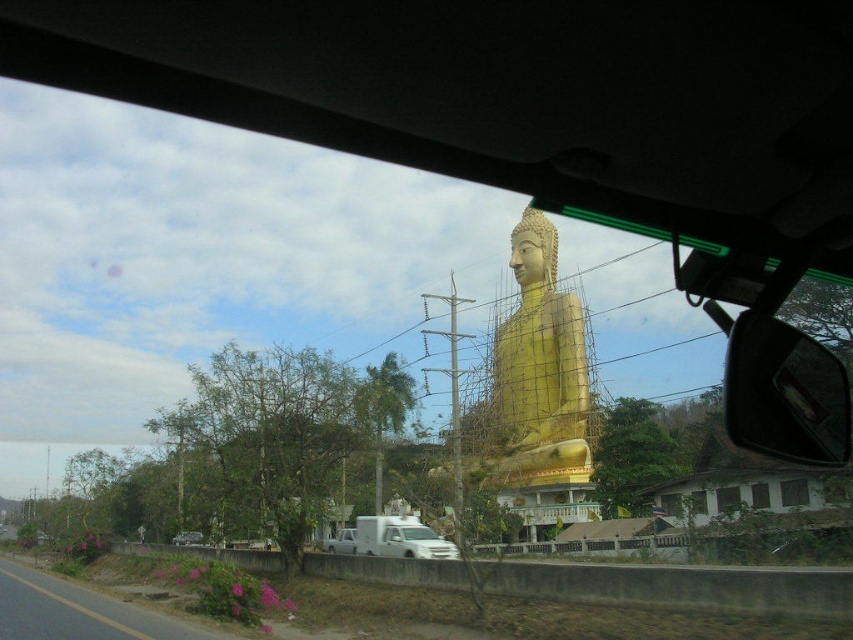
Question: Does gold polished statue at center have a smaller size compared to glossy plastic side mirror at right?

Choices:
 (A) yes
 (B) no

Answer: (B)

Question: Which object is farther from the camera taking this photo?

Choices:
 (A) gold polished statue at center
 (B) glossy plastic side mirror at right
 (C) metallic silver car at lower left

Answer: (C)

Question: Which point appears closest to the camera in this image?

Choices:
 (A) click(570, 416)
 (B) click(335, 538)
 (C) click(181, 544)
 (D) click(769, 328)

Answer: (D)

Question: Among these points, which one is nearest to the camera?

Choices:
 (A) (786, 336)
 (B) (347, 532)
 (C) (517, 276)

Answer: (A)

Question: Does gold polished statue at center have a larger size compared to white matte truck at center?

Choices:
 (A) no
 (B) yes

Answer: (B)

Question: Is gold polished statue at center closer to the viewer compared to glossy plastic side mirror at right?

Choices:
 (A) yes
 (B) no

Answer: (B)